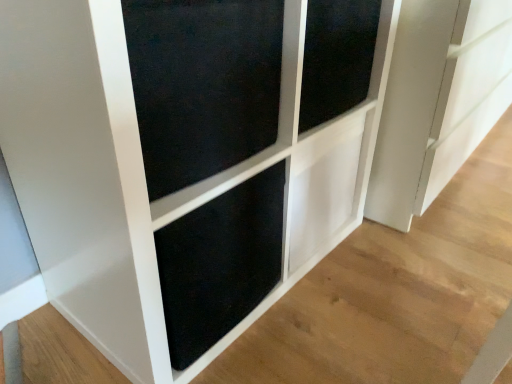
Image resolution: width=512 pixels, height=384 pixels. What do you see at coordinates (203, 84) in the screenshot?
I see `matte black screen door at center` at bounding box center [203, 84].

Where is `matte black screen door at center`? The height and width of the screenshot is (384, 512). matte black screen door at center is located at coordinates (203, 84).

Measure the distance between matte black screen door at center and camera.

matte black screen door at center is 19.53 inches away from camera.

Where is `matte black screen door at center`? This screenshot has width=512, height=384. matte black screen door at center is located at coordinates (203, 84).